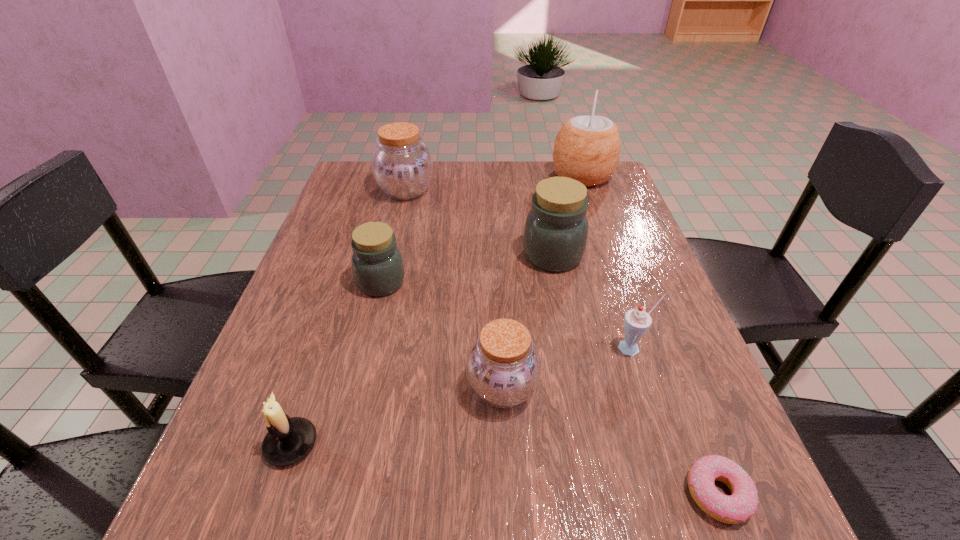
Identify the location of empty space that is in between the white candle holder and the right brown jar. This screenshot has height=540, width=960. (396, 416).

You are a GUI agent. You are given a task and a screenshot of the screen. Output one action in this format:
    pyautogui.click(x=<x>, y=<y>)
    Task: Click on the free spot between the doughnut and the white candle holder
    
    Given the screenshot: What is the action you would take?
    pyautogui.click(x=504, y=469)

Locate an element on the screen. empty space that is in between the left green jar and the smaller brown jar is located at coordinates (442, 335).

At what (x,y) coordinates should I click in order to perform the action: click on unoccupied position between the white milkshake and the farthest jar. Please return your answer as a coordinate pair (x, y). This screenshot has height=540, width=960. Looking at the image, I should click on (519, 269).

The width and height of the screenshot is (960, 540). What are the coordinates of `object that stands as the closest to the pink doughnut` in the screenshot? It's located at (636, 321).

Identify which object is the nearest to the coconut. Please provide its 2D coordinates. Your answer should be formatted as a tuple, i.e. [(x, y)], where the tuple contains the x and y coordinates of a point satisfying the conditions above.

[(556, 229)]

You are a GUI agent. You are given a task and a screenshot of the screen. Output one action in this format:
    pyautogui.click(x=<x>, y=<y>)
    Task: Click on the jar that is the nearest to the left green jar
    The image size is (960, 540).
    Given the screenshot: What is the action you would take?
    pyautogui.click(x=503, y=367)

You are a GUI agent. You are given a task and a screenshot of the screen. Output one action in this format:
    pyautogui.click(x=<x>, y=<y>)
    Task: Click on the jar that can be found as the closest to the farthest jar
    This screenshot has width=960, height=540.
    Given the screenshot: What is the action you would take?
    pyautogui.click(x=377, y=264)

Locate an element on the screen. This screenshot has width=960, height=540. free space that satisfies the following two spatial constraints: 1. on the straw side of the pink doughnut; 2. on the left side of the fourth nearest object is located at coordinates (680, 493).

Locate an element on the screen. free region that satisfies the following two spatial constraints: 1. on the front side of the right green jar; 2. on the left side of the left brown jar is located at coordinates (391, 255).